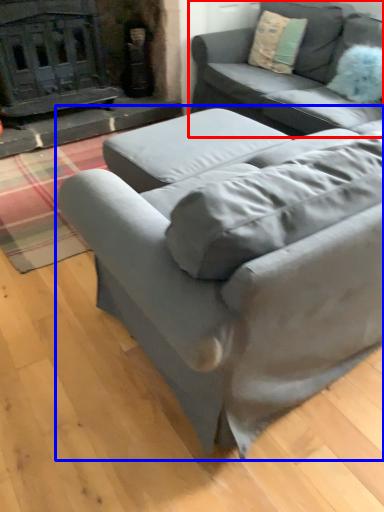
Question: Among these objects, which one is nearest to the camera, studio couch (highlighted by a red box) or studio couch (highlighted by a blue box)?

Choices:
 (A) studio couch
 (B) studio couch

Answer: (B)